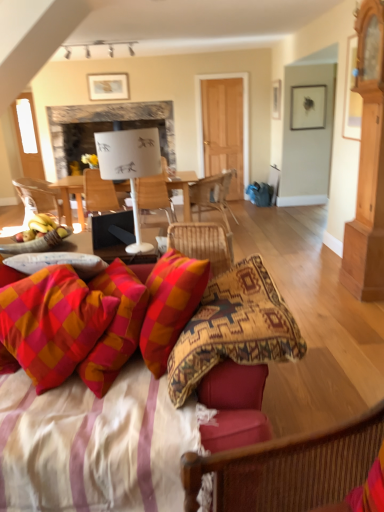
Question: In terms of width, does textured fabric couch at lower center look wider or thinner when compared to plaid fabric pillow at lower left?

Choices:
 (A) thin
 (B) wide

Answer: (B)

Question: Choose the correct answer: Is textured fabric couch at lower center inside plaid fabric pillow at lower left or outside it?

Choices:
 (A) inside
 (B) outside

Answer: (B)

Question: Which is nearer to the textured fabric couch at lower center?

Choices:
 (A) woven wood chair at center, which is the first chair from back to front
 (B) matte black picture frame at upper right, acting as the first picture frame starting from the bottom
 (C) matte gold picture frame at upper center, placed as the 2th picture frame when sorted from bottom to top
 (D) wooden chair at center, arranged as the second chair when viewed from the left
 (E) plaid fabric pillow at lower left

Answer: (E)

Question: Which object is positioned farthest from the matte black picture frame at upper right, the second picture frame in the back-to-front sequence?

Choices:
 (A) matte gold picture frame at upper center, placed as the 2th picture frame when sorted from bottom to top
 (B) wooden chair at center, arranged as the second chair when viewed from the left
 (C) woven wood chair at center, the 4th chair viewed from the back
 (D) white paperboard at center
 (E) textured fabric couch at lower center

Answer: (E)